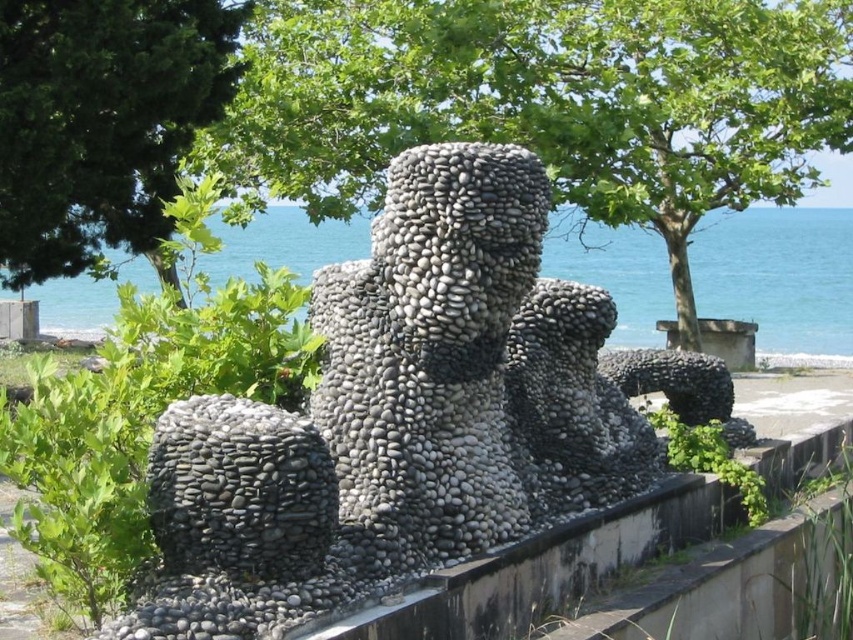
Between point (187, 552) and point (843, 92), which one is positioned behind?

The point (843, 92) is behind.

Who is more forward, (x=543, y=428) or (x=316, y=204)?

Positioned in front is point (x=543, y=428).

Who is more distant from viewer, (529, 371) or (305, 204)?

Point (305, 204)

The image size is (853, 640). Identify the location of gray pebble statue at center. (408, 419).

Who is more forward, (96, 138) or (799, 342)?

Positioned in front is point (96, 138).

Who is higher up, green leafy tree at upper left or blue water at center?

green leafy tree at upper left is above.

The height and width of the screenshot is (640, 853). Describe the element at coordinates (102, 124) in the screenshot. I see `green leafy tree at upper left` at that location.

You are a GUI agent. You are given a task and a screenshot of the screen. Output one action in this format:
    pyautogui.click(x=<x>, y=<y>)
    Task: Click on the green leafy tree at upper left
    Image resolution: width=853 pixels, height=640 pixels.
    Given the screenshot: What is the action you would take?
    pyautogui.click(x=102, y=124)

Is gray pebble statue at center taller than blue water at center?

No.

Is gray pebble statue at center smaller than blue water at center?

Indeed, gray pebble statue at center has a smaller size compared to blue water at center.

This screenshot has width=853, height=640. In order to click on gray pebble statue at center in this screenshot , I will do `click(408, 419)`.